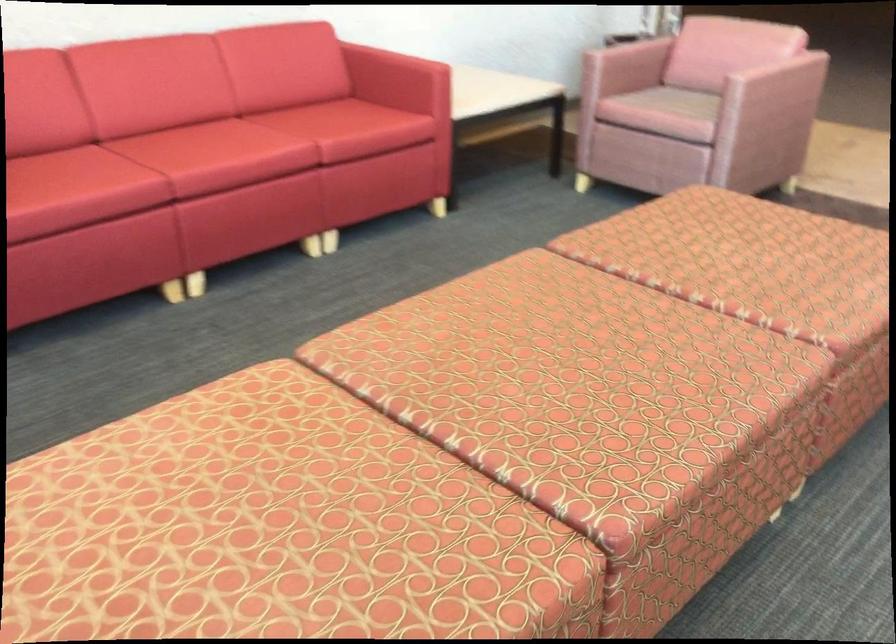
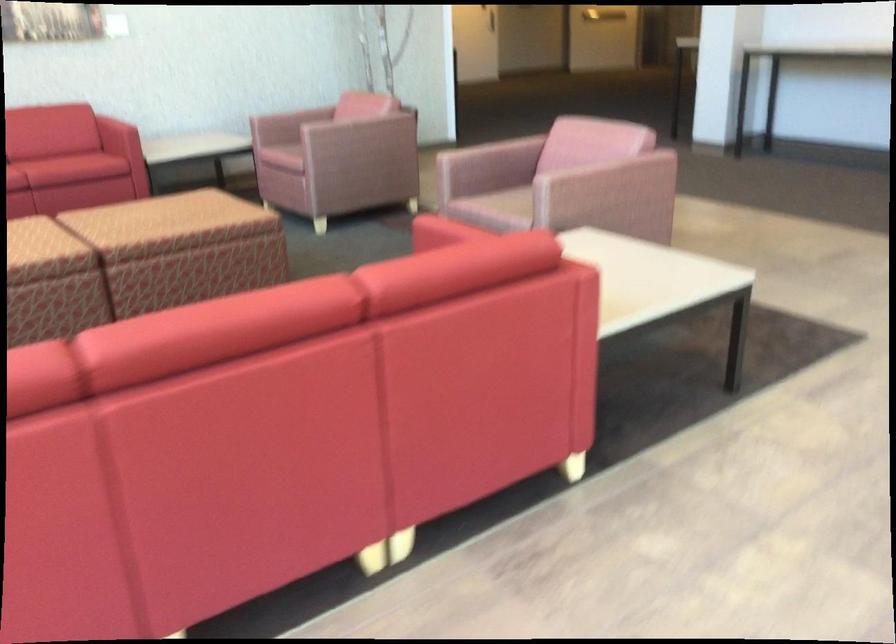
In a continuous first-person perspective shot, in which direction is the camera moving?

The cameraman walked toward right, backward.